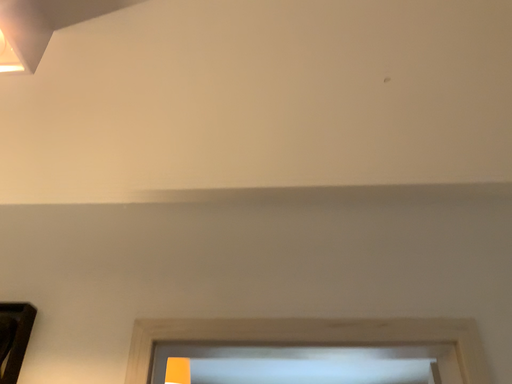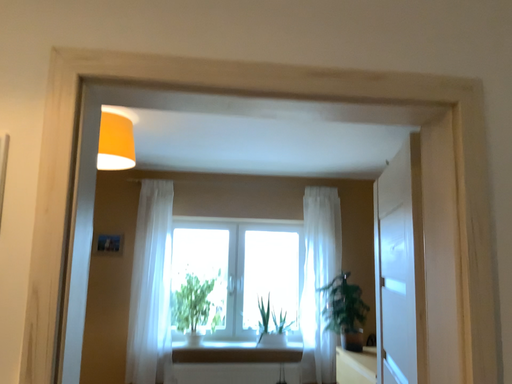
Question: Which way did the camera rotate in the video?

Choices:
 (A) rotated downward
 (B) rotated upward

Answer: (A)